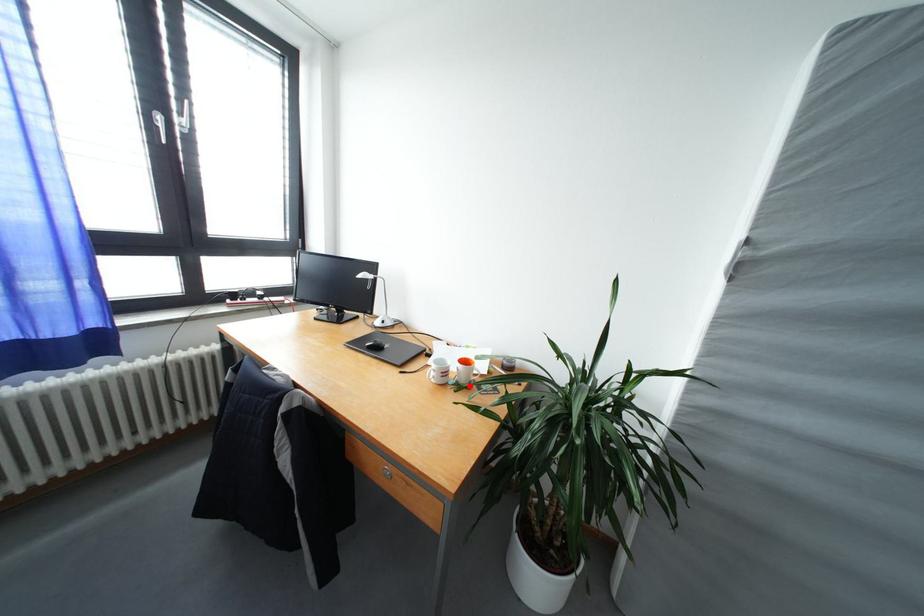
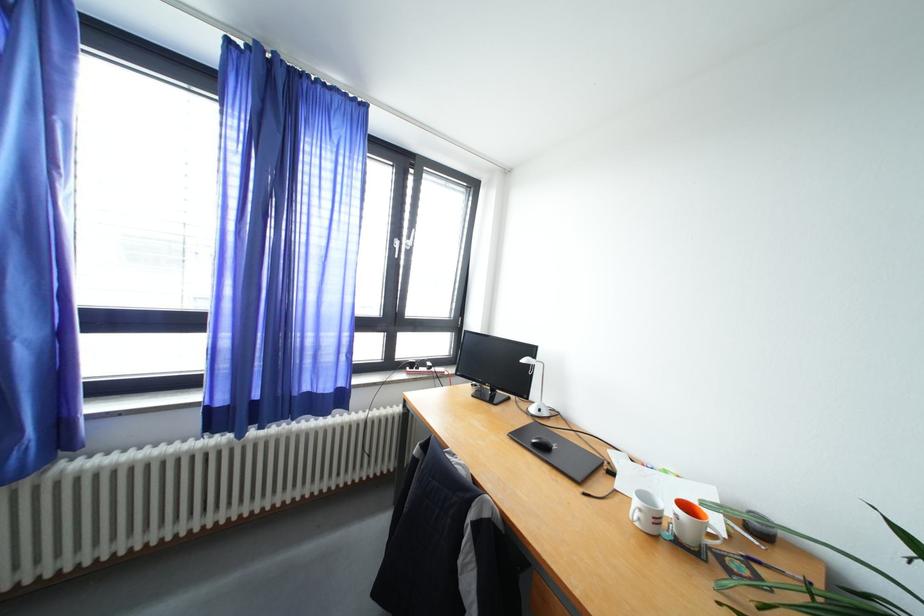
Locate, in the second image, the point that corresponds to the highlighted location in the first image.

(695, 546)